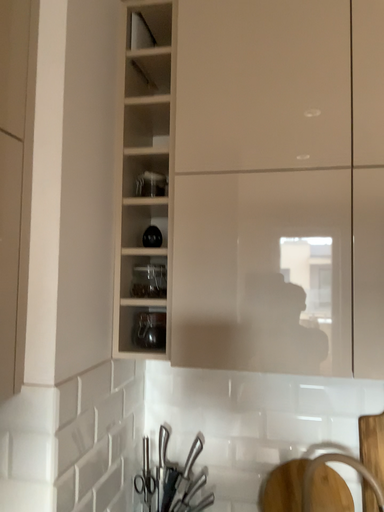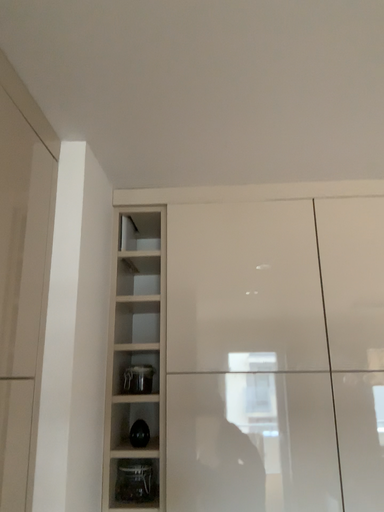
Question: How did the camera likely rotate when shooting the video?

Choices:
 (A) rotated right
 (B) rotated left

Answer: (A)